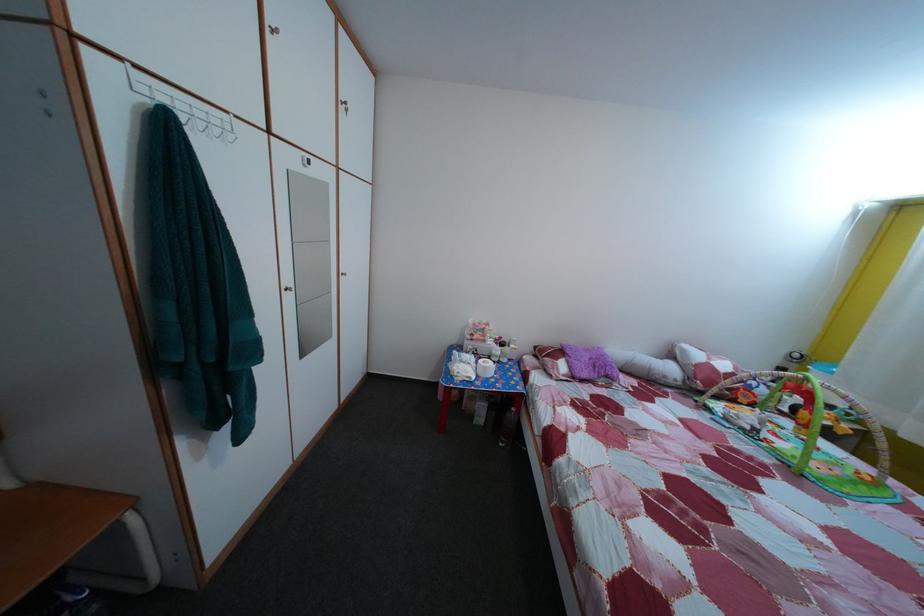
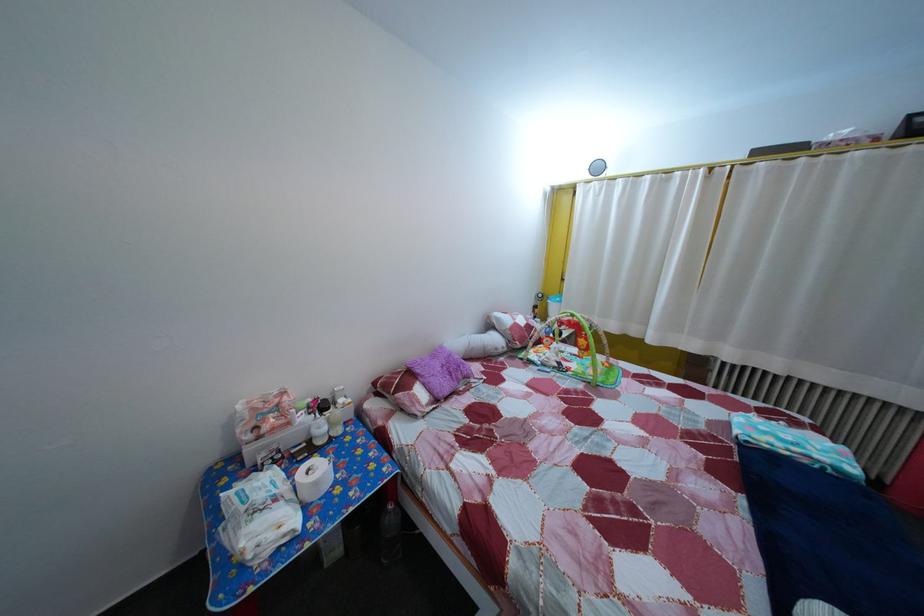
Question: I am providing you with two images of the same scene from different viewpoints. Please identify which objects are invisible in image2.

Choices:
 (A) white baby bottle
 (B) bottle pump
 (C) white tissue roll
 (D) none of these

Answer: (D)